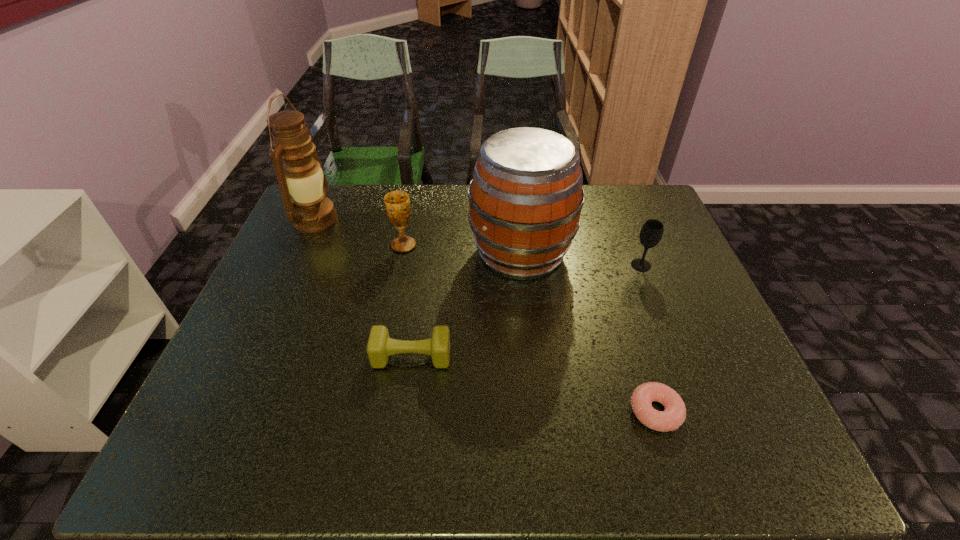
Identify the location of free point between the oil lamp and the fifth object from left to right. (486, 315).

Identify the location of free point between the shortest object and the chalice. The height and width of the screenshot is (540, 960). (530, 328).

Identify the location of blank region between the rightmost object and the fifth shortest object. (581, 259).

You are a GUI agent. You are given a task and a screenshot of the screen. Output one action in this format:
    pyautogui.click(x=<x>, y=<y>)
    Task: Click on the vacant area that lies between the fifth tallest object and the second tallest object
    
    Given the screenshot: What is the action you would take?
    pyautogui.click(x=467, y=305)

At what (x,y) coordinates should I click in order to perform the action: click on vacant area that lies between the tallest object and the cider. Please return your answer as a coordinate pair (x, y). This screenshot has height=540, width=960. Looking at the image, I should click on (419, 236).

This screenshot has width=960, height=540. I want to click on free spot between the doughnut and the oil lamp, so click(486, 315).

The width and height of the screenshot is (960, 540). In order to click on vacant area that lies between the fourth tallest object and the second nearest object in this screenshot , I will do 526,311.

Locate which object is the closest to the second object from right to left. Please provide its 2D coordinates. Your answer should be formatted as a tuple, i.e. [(x, y)], where the tuple contains the x and y coordinates of a point satisfying the conditions above.

[(525, 200)]

Identify which object is located as the fifth nearest to the tallest object. Please provide its 2D coordinates. Your answer should be formatted as a tuple, i.e. [(x, y)], where the tuple contains the x and y coordinates of a point satisfying the conditions above.

[(674, 415)]

Find the location of `vacant space that satisfies the following two spatial constraints: 1. on the front side of the chalice; 2. on the right side of the shortest object`. vacant space that satisfies the following two spatial constraints: 1. on the front side of the chalice; 2. on the right side of the shortest object is located at coordinates (372, 411).